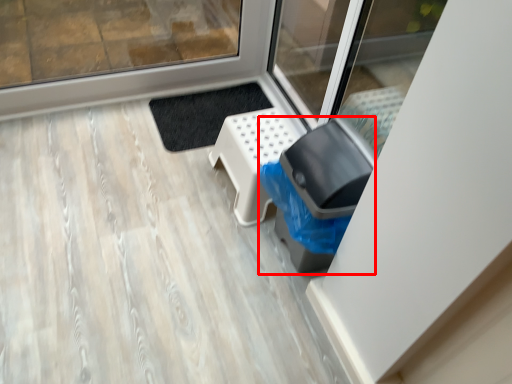
Question: From the image's perspective, where is garbage (annotated by the red box) located relative to furniture?

Choices:
 (A) below
 (B) above

Answer: (A)